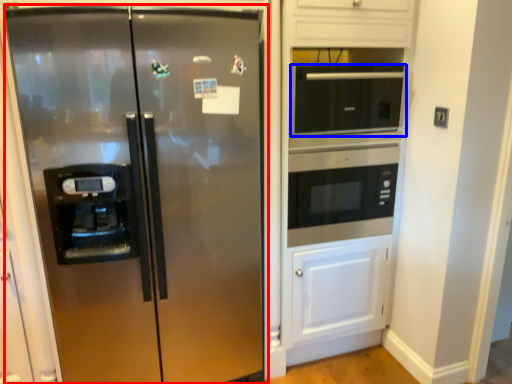
Question: Which object appears closest to the camera in this image, refrigerator (highlighted by a red box) or microwave oven (highlighted by a blue box)?

Choices:
 (A) refrigerator
 (B) microwave oven

Answer: (A)